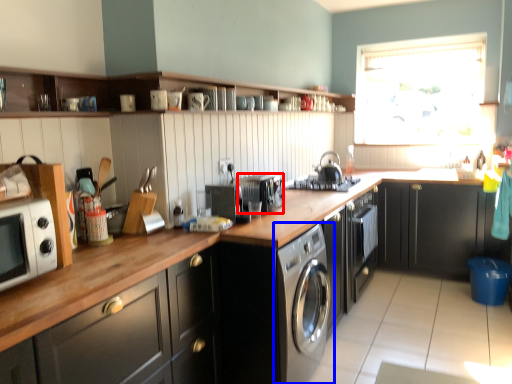
Question: Which object is further to the camera taking this photo, appliance (highlighted by a red box) or washing machine (highlighted by a blue box)?

Choices:
 (A) appliance
 (B) washing machine

Answer: (A)